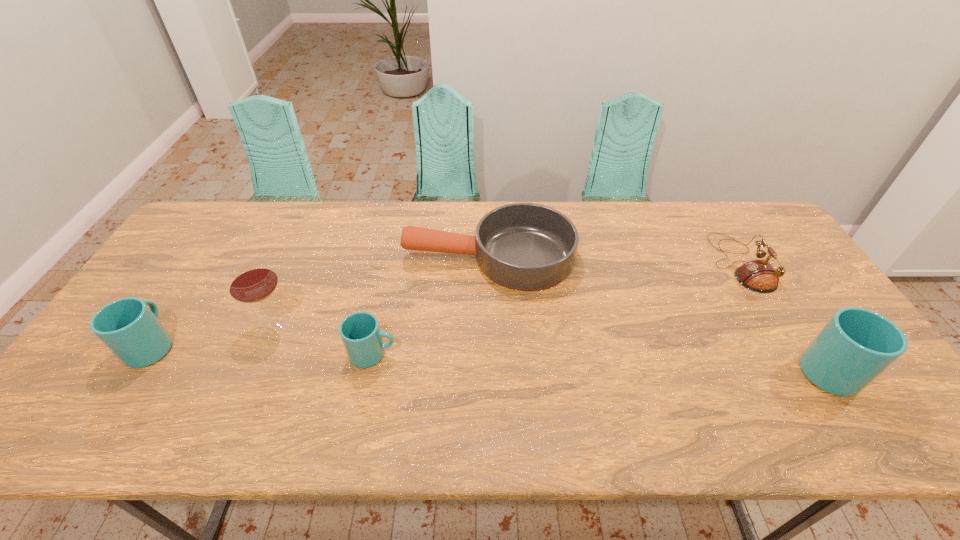
Identify the location of vacant space located 0.350m on the handle side of the third tallest object. (222, 238).

The width and height of the screenshot is (960, 540). In order to click on free location located 0.250m on the handle side of the second cup from right to left in this screenshot , I will do `click(496, 354)`.

Locate an element on the screen. This screenshot has height=540, width=960. vacant position located 0.130m on the handle side of the pan is located at coordinates (362, 258).

At what (x,y) coordinates should I click in order to perform the action: click on vacant space located on the handle side of the pan. Please return your answer as a coordinate pair (x, y). This screenshot has width=960, height=540. Looking at the image, I should click on (388, 258).

Identify the location of free region located 0.390m on the handle side of the pan. The height and width of the screenshot is (540, 960). (277, 258).

Identify the location of free spot located 0.140m on the left of the wineglass. The width and height of the screenshot is (960, 540). (201, 326).

The image size is (960, 540). In order to click on vacant space situated 0.290m on the rotary dial of the telephone in this screenshot , I will do `click(618, 264)`.

Locate an element on the screen. vacant space located 0.330m on the rotary dial of the telephone is located at coordinates (605, 264).

The image size is (960, 540). I want to click on vacant region located 0.060m on the rotary dial of the telephone, so pos(694,264).

Locate an element on the screen. The width and height of the screenshot is (960, 540). pan that is positioned at the far edge is located at coordinates (524, 246).